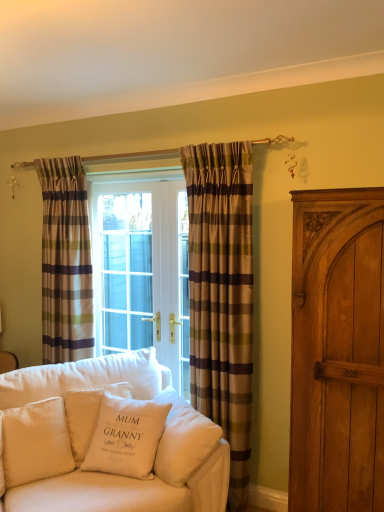
Question: Is white cotton pillow at center, positioned as the second pillow in left-to-right order, in front of plaid fabric curtain at left, the second curtain when ordered from front to back?

Choices:
 (A) no
 (B) yes

Answer: (B)

Question: Considering the relative sizes of white cotton pillow at center, which is counted as the third pillow, starting from the right, and plaid fabric curtain at left, the second curtain when ordered from front to back, in the image provided, is white cotton pillow at center, which is counted as the third pillow, starting from the right, bigger than plaid fabric curtain at left, the second curtain when ordered from front to back,?

Choices:
 (A) no
 (B) yes

Answer: (A)

Question: Considering the relative sizes of white cotton pillow at center, positioned as the second pillow in left-to-right order, and plaid fabric curtain at left, the first curtain when ordered from left to right, in the image provided, is white cotton pillow at center, positioned as the second pillow in left-to-right order, smaller than plaid fabric curtain at left, the first curtain when ordered from left to right,?

Choices:
 (A) no
 (B) yes

Answer: (B)

Question: From the image's perspective, is white cotton pillow at center, positioned as the second pillow in left-to-right order, beneath plaid fabric curtain at left, the second curtain from the right?

Choices:
 (A) yes
 (B) no

Answer: (A)

Question: From a real-world perspective, is white cotton pillow at center, positioned as the second pillow in left-to-right order, positioned over plaid fabric curtain at left, the second curtain when ordered from front to back, based on gravity?

Choices:
 (A) no
 (B) yes

Answer: (A)

Question: Is white cotton pillow at center, which is counted as the third pillow, starting from the right, aimed at plaid fabric curtain at left, the first curtain when ordered from left to right?

Choices:
 (A) no
 (B) yes

Answer: (A)

Question: Is white soft cushion at lower left, which appears as the 1th pillow when viewed from the right, looking in the opposite direction of white quilted pillow at lower left, the fourth pillow when ordered from right to left?

Choices:
 (A) no
 (B) yes

Answer: (A)

Question: Is white soft cushion at lower left, the 4th pillow viewed from the left, not near white quilted pillow at lower left, marked as the 1th pillow in a left-to-right arrangement?

Choices:
 (A) yes
 (B) no

Answer: (B)

Question: From a real-world perspective, does white soft cushion at lower left, which appears as the 1th pillow when viewed from the right, sit lower than white quilted pillow at lower left, marked as the 1th pillow in a left-to-right arrangement?

Choices:
 (A) yes
 (B) no

Answer: (B)

Question: Is white soft cushion at lower left, the 4th pillow viewed from the left, aimed at white quilted pillow at lower left, the fourth pillow when ordered from right to left?

Choices:
 (A) yes
 (B) no

Answer: (A)

Question: Can you confirm if white soft cushion at lower left, which appears as the 1th pillow when viewed from the right, is shorter than white quilted pillow at lower left, the fourth pillow when ordered from right to left?

Choices:
 (A) yes
 (B) no

Answer: (A)

Question: Is white soft cushion at lower left, the 4th pillow viewed from the left, closer to the viewer compared to white quilted pillow at lower left, the fourth pillow when ordered from right to left?

Choices:
 (A) yes
 (B) no

Answer: (A)

Question: Considering the relative sizes of plaid fabric curtain at center, placed as the second curtain when sorted from back to front, and white quilted pillow at lower left, the fourth pillow when ordered from right to left, in the image provided, is plaid fabric curtain at center, placed as the second curtain when sorted from back to front, thinner than white quilted pillow at lower left, the fourth pillow when ordered from right to left,?

Choices:
 (A) no
 (B) yes

Answer: (B)